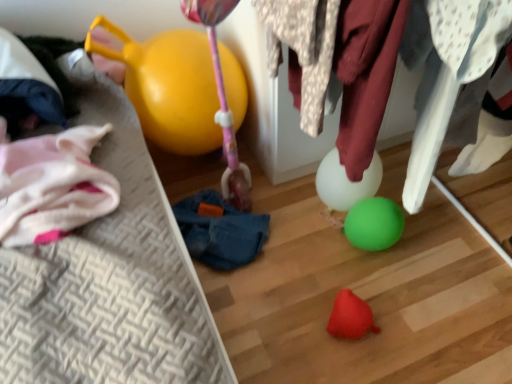
Identify the location of white fabric at upper right, the 2th clothing viewed from the left. The width and height of the screenshot is (512, 384). (449, 77).

Measure the distance between point (x=304, y=25) and camera.

Point (x=304, y=25) is 25.91 inches from camera.

The width and height of the screenshot is (512, 384). In order to click on white fabric at upper right, the 2th clothing viewed from the left in this screenshot , I will do `click(449, 77)`.

Is white fabric at upper right, the 2th clothing viewed from the left, wider or thinner than spotted fabric at center, the 1th clothing in the left-to-right sequence?

Clearly, white fabric at upper right, the 2th clothing viewed from the left, has less width compared to spotted fabric at center, the 1th clothing in the left-to-right sequence.

Does point (464, 16) come in front of point (291, 42)?

Yes, it is.

From the image's perspective, between white fabric at upper right, the 2th clothing viewed from the left, and spotted fabric at center, the 1th clothing in the left-to-right sequence, which one is located above?

spotted fabric at center, the 1th clothing in the left-to-right sequence, appears higher in the image.

Is white fabric at upper right, the 2th clothing viewed from the left, directly adjacent to spotted fabric at center, the 1th clothing in the left-to-right sequence?

white fabric at upper right, the 2th clothing viewed from the left, and spotted fabric at center, the 1th clothing in the left-to-right sequence, are clearly separated.

Could you tell me if yellow rubber balloon at upper left is facing spotted fabric at center, which ranks as the 2th clothing in right-to-left order?

Yes, yellow rubber balloon at upper left faces towards spotted fabric at center, which ranks as the 2th clothing in right-to-left order.

Who is more distant, yellow rubber balloon at upper left or spotted fabric at center, the 1th clothing in the left-to-right sequence?

yellow rubber balloon at upper left is further away from the camera.

From the picture: Who is taller, yellow rubber balloon at upper left or spotted fabric at center, the 1th clothing in the left-to-right sequence?

yellow rubber balloon at upper left is taller.

From the image's perspective, is yellow rubber balloon at upper left above spotted fabric at center, which ranks as the 2th clothing in right-to-left order?

Yes, from the image's perspective, yellow rubber balloon at upper left is above spotted fabric at center, which ranks as the 2th clothing in right-to-left order.

Is spotted fabric at center, the 1th clothing in the left-to-right sequence, completely or partially inside blue fabric bean bag chair at center?

No, spotted fabric at center, the 1th clothing in the left-to-right sequence, is not inside blue fabric bean bag chair at center.

From a real-world perspective, which object rests below the other?

blue fabric bean bag chair at center is physically lower.

Are blue fabric bean bag chair at center and spotted fabric at center, the 1th clothing in the left-to-right sequence, located far from each other?

blue fabric bean bag chair at center is actually quite close to spotted fabric at center, the 1th clothing in the left-to-right sequence.

Considering the positions of objects rubber red toy at lower center and white fabric at upper right, the 2th clothing viewed from the left, in the image provided, who is more to the right, rubber red toy at lower center or white fabric at upper right, the 2th clothing viewed from the left,?

white fabric at upper right, the 2th clothing viewed from the left.

From the image's perspective, between rubber red toy at lower center and white fabric at upper right, the 2th clothing viewed from the left, which one is located above?

From the image's view, white fabric at upper right, the 2th clothing viewed from the left, is above.

Is rubber red toy at lower center thinner than white fabric at upper right, the 2th clothing viewed from the left?

Yes.

Consider the image. Is white fabric at upper right, the 2th clothing viewed from the left, turned away from rubber red toy at lower center?

No, white fabric at upper right, the 2th clothing viewed from the left, is not facing away from rubber red toy at lower center.

Identify the location of toy behind the white fabric at upper right, marked as the first clothing in a right-to-left arrangement. (350, 317).

Is point (430, 130) positioned behind point (350, 324)?

No, (430, 130) is in front of (350, 324).

Between white fabric at upper right, marked as the first clothing in a right-to-left arrangement, and rubber red toy at lower center, which one has smaller width?

With smaller width is rubber red toy at lower center.

Do you think blue fabric bean bag chair at center is within rubber red toy at lower center, or outside of it?

blue fabric bean bag chair at center is not inside rubber red toy at lower center, it's outside.

Is blue fabric bean bag chair at center in front of or behind rubber red toy at lower center in the image?

blue fabric bean bag chair at center is behind rubber red toy at lower center.

Is blue fabric bean bag chair at center positioned with its back to rubber red toy at lower center?

No, rubber red toy at lower center is not at the back of blue fabric bean bag chair at center.

Identify the location of bean bag chair behind the rubber red toy at lower center. The height and width of the screenshot is (384, 512). (220, 232).

In the scene shown: Is yellow rubber balloon at upper left thinner than rubber red toy at lower center?

Incorrect, the width of yellow rubber balloon at upper left is not less than that of rubber red toy at lower center.

Is point (172, 135) positioned before point (343, 307)?

No, (172, 135) is behind (343, 307).

Does yellow rubber balloon at upper left have a larger size compared to rubber red toy at lower center?

Indeed, yellow rubber balloon at upper left has a larger size compared to rubber red toy at lower center.

Looking at this image, is yellow rubber balloon at upper left turned away from rubber red toy at lower center?

No, yellow rubber balloon at upper left is not facing away from rubber red toy at lower center.

Where is `clothing located behind the spotted fabric at center, which ranks as the 2th clothing in right-to-left order`? Image resolution: width=512 pixels, height=384 pixels. clothing located behind the spotted fabric at center, which ranks as the 2th clothing in right-to-left order is located at coordinates (449, 77).

Identify the location of balloon on the left of spotted fabric at center, the 1th clothing in the left-to-right sequence. The width and height of the screenshot is (512, 384). (168, 86).

Considering their positions, is spotted fabric at center, the 1th clothing in the left-to-right sequence, positioned closer to blue fabric bean bag chair at center than yellow rubber balloon at upper left?

The object closer to blue fabric bean bag chair at center is yellow rubber balloon at upper left.

Based on their spatial positions, is blue fabric bean bag chair at center or white fabric at upper right, the 2th clothing viewed from the left, further from yellow rubber balloon at upper left?

Based on the image, white fabric at upper right, the 2th clothing viewed from the left, appears to be further to yellow rubber balloon at upper left.

Estimate the real-world distances between objects in this image. Which object is closer to yellow rubber balloon at upper left, spotted fabric at center, the 1th clothing in the left-to-right sequence, or rubber red toy at lower center?

spotted fabric at center, the 1th clothing in the left-to-right sequence.

Which object lies nearer to the anchor point white fabric at upper right, the 2th clothing viewed from the left, rubber red toy at lower center or yellow rubber balloon at upper left?

rubber red toy at lower center is positioned closer to the anchor white fabric at upper right, the 2th clothing viewed from the left.

When comparing their distances from blue fabric bean bag chair at center, does rubber red toy at lower center or white fabric at upper right, marked as the first clothing in a right-to-left arrangement, seem further?

The object further to blue fabric bean bag chair at center is white fabric at upper right, marked as the first clothing in a right-to-left arrangement.

Which object lies nearer to the anchor point rubber red toy at lower center, white fabric at upper right, the 2th clothing viewed from the left, or spotted fabric at center, the 1th clothing in the left-to-right sequence?

Based on the image, white fabric at upper right, the 2th clothing viewed from the left, appears to be nearer to rubber red toy at lower center.

Considering their positions, is yellow rubber balloon at upper left positioned closer to spotted fabric at center, which ranks as the 2th clothing in right-to-left order, than white fabric at upper right, marked as the first clothing in a right-to-left arrangement?

white fabric at upper right, marked as the first clothing in a right-to-left arrangement.

Looking at the image, which one is located closer to white fabric at upper right, the 2th clothing viewed from the left, spotted fabric at center, which ranks as the 2th clothing in right-to-left order, or rubber red toy at lower center?

The object closer to white fabric at upper right, the 2th clothing viewed from the left, is spotted fabric at center, which ranks as the 2th clothing in right-to-left order.

Locate an element on the screen. Image resolution: width=512 pixels, height=384 pixels. clothing between spotted fabric at center, the 1th clothing in the left-to-right sequence, and blue fabric bean bag chair at center, along the z-axis is located at coordinates tap(449, 77).

Where is `toy between spotted fabric at center, which ranks as the 2th clothing in right-to-left order, and blue fabric bean bag chair at center in the front-back direction`? toy between spotted fabric at center, which ranks as the 2th clothing in right-to-left order, and blue fabric bean bag chair at center in the front-back direction is located at coordinates (350, 317).

Where is `clothing that lies between spotted fabric at center, which ranks as the 2th clothing in right-to-left order, and rubber red toy at lower center from top to bottom`? The image size is (512, 384). clothing that lies between spotted fabric at center, which ranks as the 2th clothing in right-to-left order, and rubber red toy at lower center from top to bottom is located at coordinates (449, 77).

Find the location of a particular element. toy between white fabric at upper right, marked as the first clothing in a right-to-left arrangement, and blue fabric bean bag chair at center from front to back is located at coordinates (350, 317).